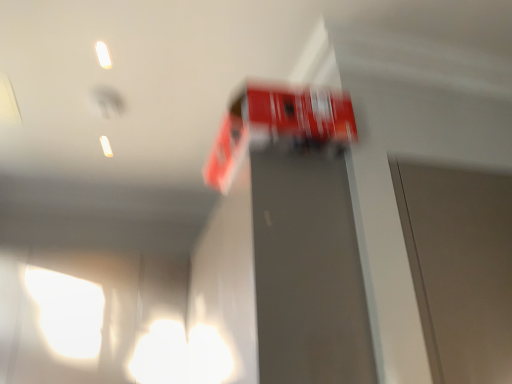
In order to face red glossy fire truck at upper center, should I rotate leftwards or rightwards?

It's best to rotate right around 2.422 degrees.

Measure the distance between red glossy fire truck at upper center and camera.

red glossy fire truck at upper center is 4.65 feet away from camera.

You are a GUI agent. You are given a task and a screenshot of the screen. Output one action in this format:
    pyautogui.click(x=<x>, y=<y>)
    Task: Click on the red glossy fire truck at upper center
    The width and height of the screenshot is (512, 384).
    Given the screenshot: What is the action you would take?
    pyautogui.click(x=278, y=125)

The image size is (512, 384). What do you see at coordinates (278, 125) in the screenshot?
I see `red glossy fire truck at upper center` at bounding box center [278, 125].

The height and width of the screenshot is (384, 512). What do you see at coordinates (308, 270) in the screenshot?
I see `metallic gray elevator door at center` at bounding box center [308, 270].

At what (x,y) coordinates should I click in order to perform the action: click on metallic gray elevator door at center. Please return your answer as a coordinate pair (x, y). The image size is (512, 384). Looking at the image, I should click on (308, 270).

Locate an element on the screen. Image resolution: width=512 pixels, height=384 pixels. red glossy fire truck at upper center is located at coordinates (278, 125).

Based on their positions, is metallic gray elevator door at center located to the left or right of red glossy fire truck at upper center?

In the image, metallic gray elevator door at center appears on the left side of red glossy fire truck at upper center.

Who is more distant, metallic gray elevator door at center or red glossy fire truck at upper center?

red glossy fire truck at upper center is behind.

Does point (316, 162) come closer to viewer compared to point (321, 119)?

No, it is behind (321, 119).

Consider the image. From the image's perspective, which one is positioned lower, metallic gray elevator door at center or red glossy fire truck at upper center?

metallic gray elevator door at center appears lower in the image.

From a real-world perspective, is metallic gray elevator door at center under red glossy fire truck at upper center?

Yes.

Between metallic gray elevator door at center and red glossy fire truck at upper center, which one has smaller width?

Thinner between the two is metallic gray elevator door at center.

Considering the sizes of objects metallic gray elevator door at center and red glossy fire truck at upper center in the image provided, who is shorter, metallic gray elevator door at center or red glossy fire truck at upper center?

red glossy fire truck at upper center.

Is metallic gray elevator door at center smaller than red glossy fire truck at upper center?

Incorrect, metallic gray elevator door at center is not smaller in size than red glossy fire truck at upper center.

Is metallic gray elevator door at center completely or partially outside of red glossy fire truck at upper center?

Yes.

Is the surface of metallic gray elevator door at center in direct contact with red glossy fire truck at upper center?

No, metallic gray elevator door at center is not next to red glossy fire truck at upper center.

Is metallic gray elevator door at center turned away from red glossy fire truck at upper center?

No, red glossy fire truck at upper center is not at the back of metallic gray elevator door at center.

Can you tell me how much metallic gray elevator door at center and red glossy fire truck at upper center differ in facing direction?

The facing directions of metallic gray elevator door at center and red glossy fire truck at upper center are 1.62 degrees apart.

How far apart are metallic gray elevator door at center and red glossy fire truck at upper center?

11.21 inches.

Find the location of a particular element. vehicle above the metallic gray elevator door at center (from the image's perspective) is located at coordinates (278, 125).

In the scene shown: Can you confirm if red glossy fire truck at upper center is positioned to the right of metallic gray elevator door at center?

Correct, you'll find red glossy fire truck at upper center to the right of metallic gray elevator door at center.

Who is more distant, red glossy fire truck at upper center or metallic gray elevator door at center?

red glossy fire truck at upper center is behind.

Is point (305, 98) farther from viewer compared to point (334, 196)?

No.

From the image's perspective, does red glossy fire truck at upper center appear lower than metallic gray elevator door at center?

No, from the image's perspective, red glossy fire truck at upper center is not below metallic gray elevator door at center.

From a real-world perspective, is red glossy fire truck at upper center positioned under metallic gray elevator door at center based on gravity?

No, from a real-world perspective, red glossy fire truck at upper center is not below metallic gray elevator door at center.

Between red glossy fire truck at upper center and metallic gray elevator door at center, which one has smaller width?

Thinner between the two is metallic gray elevator door at center.

Considering the relative sizes of red glossy fire truck at upper center and metallic gray elevator door at center in the image provided, is red glossy fire truck at upper center taller than metallic gray elevator door at center?

In fact, red glossy fire truck at upper center may be shorter than metallic gray elevator door at center.

Does red glossy fire truck at upper center have a larger size compared to metallic gray elevator door at center?

Actually, red glossy fire truck at upper center might be smaller than metallic gray elevator door at center.

Is red glossy fire truck at upper center completely or partially outside of metallic gray elevator door at center?

Absolutely, red glossy fire truck at upper center is external to metallic gray elevator door at center.

Are red glossy fire truck at upper center and metallic gray elevator door at center far apart?

red glossy fire truck at upper center is actually quite close to metallic gray elevator door at center.

Is red glossy fire truck at upper center turned away from metallic gray elevator door at center?

That's not correct — red glossy fire truck at upper center is not looking away from metallic gray elevator door at center.

Consider the image. Measure the distance between red glossy fire truck at upper center and metallic gray elevator door at center.

A distance of 11.21 inches exists between red glossy fire truck at upper center and metallic gray elevator door at center.

Identify the location of elevator door below the red glossy fire truck at upper center (from the image's perspective). Image resolution: width=512 pixels, height=384 pixels. (308, 270).

This screenshot has height=384, width=512. Find the location of `vehicle behind the metallic gray elevator door at center`. vehicle behind the metallic gray elevator door at center is located at coordinates (278, 125).

Identify the location of elevator door located below the red glossy fire truck at upper center (from the image's perspective). (308, 270).